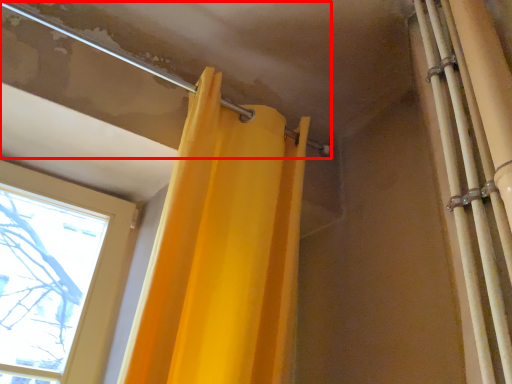
Question: Where is pipe (annotated by the red box) located in relation to shower curtain in the image?

Choices:
 (A) left
 (B) right

Answer: (A)